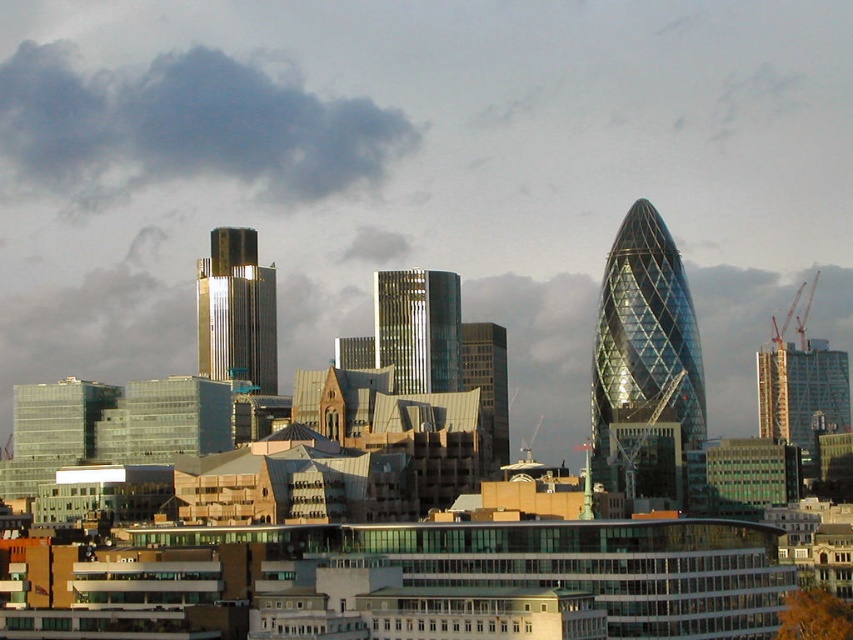
You are standing in the city and looking at the skyline. There are two points marked on the image, point 1 at coordinates point (412, 272) and point 2 at coordinates point (490, 412). If you want to walk towards the nearest point, which one should you head towards?

Point (412, 272) is closer to the viewer than point (490, 412), so you should head towards point (412, 272).

You are standing at the camera position and want to know the distance to a specific point in the scene. The point is labeled as point (653, 406). Can you tell me how far it is from where you are standing?

The point (653, 406) is 661.04 meters away from the camera position.

You are a city planner evaluating the potential for a new solar panel installation on the gold reflective glass skyscraper at center. Considering the position of the dark gray cloud at upper left, would the cloud currently block sunlight from reaching the skyscraper?

The dark gray cloud at upper left might be wider than the gold reflective glass skyscraper at center, so there is a possibility that the cloud could block sunlight from reaching the skyscraper depending on its position and movement.